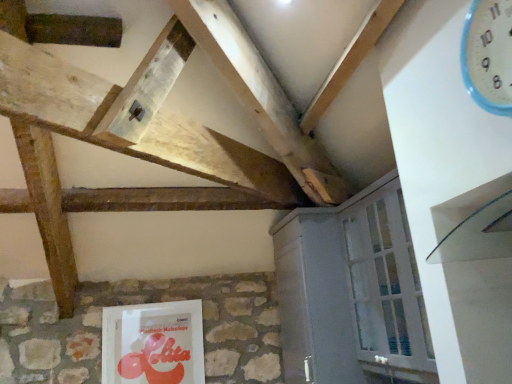
I want to click on white painted wood cabinet at lower right, so click(352, 292).

The image size is (512, 384). What are the coordinates of `matte plastic book at lower center` in the screenshot? It's located at (153, 343).

What are the coordinates of `white painted wood cabinet at lower right` in the screenshot? It's located at [352, 292].

From the image's perspective, which object appears higher, white plastic clock at upper right or matte plastic book at lower center?

From the image's view, white plastic clock at upper right is above.

Would you say white plastic clock at upper right contains matte plastic book at lower center?

That's incorrect, matte plastic book at lower center is not inside white plastic clock at upper right.

Are white plastic clock at upper right and matte plastic book at lower center located far from each other?

Absolutely, white plastic clock at upper right is distant from matte plastic book at lower center.

Considering the sizes of objects white plastic clock at upper right and matte plastic book at lower center in the image provided, who is wider, white plastic clock at upper right or matte plastic book at lower center?

white plastic clock at upper right is wider.

Looking at the image, does white plastic clock at upper right seem bigger or smaller compared to white painted wood cabinet at lower right?

Clearly, white plastic clock at upper right is smaller in size than white painted wood cabinet at lower right.

Is white plastic clock at upper right oriented towards white painted wood cabinet at lower right?

No, white plastic clock at upper right is not facing towards white painted wood cabinet at lower right.

Is white plastic clock at upper right situated inside white painted wood cabinet at lower right or outside?

white plastic clock at upper right is located beyond the bounds of white painted wood cabinet at lower right.

From the image's perspective, which one is positioned lower, white plastic clock at upper right or white painted wood cabinet at lower right?

white painted wood cabinet at lower right, from the image's perspective.

From the image's perspective, is matte plastic book at lower center positioned above or below white painted wood cabinet at lower right?

matte plastic book at lower center is situated lower than white painted wood cabinet at lower right in the image.

Would you say matte plastic book at lower center is outside white painted wood cabinet at lower right?

Yes, matte plastic book at lower center is not within white painted wood cabinet at lower right.

Can you tell me how much matte plastic book at lower center and white painted wood cabinet at lower right differ in facing direction?

The angular difference between matte plastic book at lower center and white painted wood cabinet at lower right is 88.2 degrees.

Considering the relative positions of matte plastic book at lower center and white painted wood cabinet at lower right in the image provided, is matte plastic book at lower center behind white painted wood cabinet at lower right?

Yes, matte plastic book at lower center is further from the viewer.

Is point (298, 306) positioned in front of point (486, 48)?

No, it is behind (486, 48).

Does white painted wood cabinet at lower right come behind white plastic clock at upper right?

Yes, it is behind white plastic clock at upper right.

From their relative heights in the image, would you say white painted wood cabinet at lower right is taller or shorter than white plastic clock at upper right?

Considering their sizes, white painted wood cabinet at lower right has more height than white plastic clock at upper right.

From a real-world perspective, which object rests below the other?

From a 3D spatial view, white painted wood cabinet at lower right is below.

From the image's perspective, between white painted wood cabinet at lower right and matte plastic book at lower center, which one is located above?

From the image's view, white painted wood cabinet at lower right is above.

Which object is thinner, white painted wood cabinet at lower right or matte plastic book at lower center?

Thinner between the two is matte plastic book at lower center.

Which object is positioned more to the left, white painted wood cabinet at lower right or matte plastic book at lower center?

matte plastic book at lower center is more to the left.

How different are the orientations of white painted wood cabinet at lower right and matte plastic book at lower center in degrees?

There is a 88.2-degree angle between the facing directions of white painted wood cabinet at lower right and matte plastic book at lower center.

Considering the positions of objects matte plastic book at lower center and white plastic clock at upper right in the image provided, who is more to the left, matte plastic book at lower center or white plastic clock at upper right?

From the viewer's perspective, matte plastic book at lower center appears more on the left side.

Is matte plastic book at lower center positioned beyond the bounds of white plastic clock at upper right?

That's correct, matte plastic book at lower center is outside of white plastic clock at upper right.

Is matte plastic book at lower center turned away from white plastic clock at upper right?

matte plastic book at lower center is not turned away from white plastic clock at upper right.

In the scene shown: Which is more distant, (133, 332) or (505, 3)?

Point (133, 332)

Locate an element on the screen. The width and height of the screenshot is (512, 384). picture frame that appears on the left of white plastic clock at upper right is located at coordinates (153, 343).

Locate an element on the screen. cabinetry below the white plastic clock at upper right (from the image's perspective) is located at coordinates (352, 292).

Estimate the real-world distances between objects in this image. Which object is further from matte plastic book at lower center, white plastic clock at upper right or white painted wood cabinet at lower right?

Among the two, white plastic clock at upper right is located further to matte plastic book at lower center.

Considering their positions, is white painted wood cabinet at lower right positioned further to matte plastic book at lower center than white plastic clock at upper right?

white plastic clock at upper right.

From the image, which object appears to be farther from white painted wood cabinet at lower right, matte plastic book at lower center or white plastic clock at upper right?

Among the two, white plastic clock at upper right is located further to white painted wood cabinet at lower right.

From the image, which object appears to be nearer to white plastic clock at upper right, matte plastic book at lower center or white painted wood cabinet at lower right?

white painted wood cabinet at lower right lies closer to white plastic clock at upper right than the other object.

Which object lies nearer to the anchor point white painted wood cabinet at lower right, white plastic clock at upper right or matte plastic book at lower center?

Among the two, matte plastic book at lower center is located nearer to white painted wood cabinet at lower right.

Looking at the image, which one is located closer to white plastic clock at upper right, white painted wood cabinet at lower right or matte plastic book at lower center?

Based on the image, white painted wood cabinet at lower right appears to be nearer to white plastic clock at upper right.

Identify the location of cabinetry between white plastic clock at upper right and matte plastic book at lower center in the front-back direction. coord(352,292).